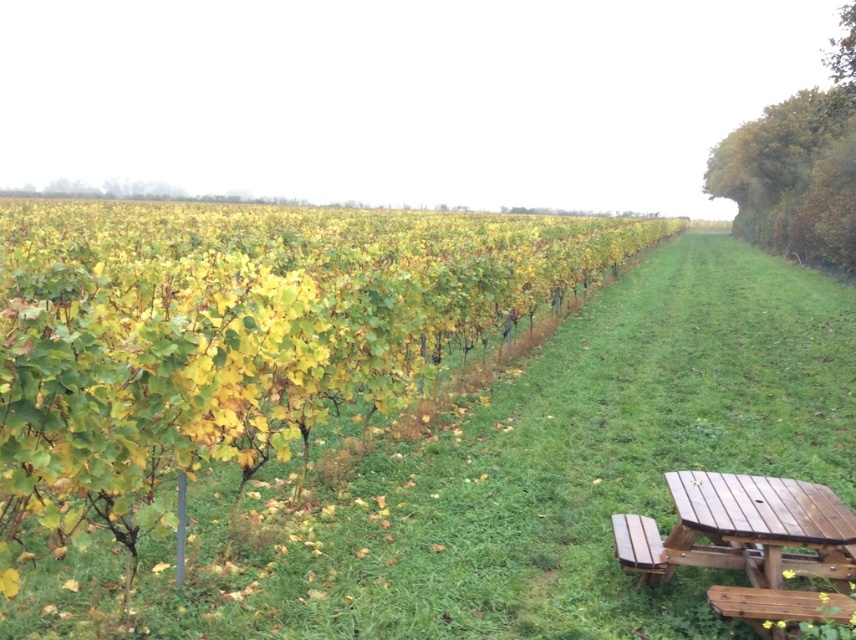
Who is shorter, green grassy at center or wooden bench at lower right?

wooden bench at lower right is shorter.

Who is more forward, (x=556, y=445) or (x=632, y=520)?

Point (x=632, y=520)

Between point (425, 492) and point (648, 570), which one is positioned in front?

Point (648, 570) is in front.

Where is `green grassy at center`? This screenshot has width=856, height=640. green grassy at center is located at coordinates (516, 480).

Who is more distant from viewer, (759, 600) or (629, 548)?

The point (629, 548) is behind.

Who is shorter, wooden picnic table at lower right or wooden bench at lower right?

Standing shorter between the two is wooden bench at lower right.

Does point (728, 502) come closer to viewer compared to point (633, 554)?

Yes, point (728, 502) is closer to viewer.

Find the location of a particular element. wooden picnic table at lower right is located at coordinates (747, 538).

What do you see at coordinates (516, 480) in the screenshot? I see `green grassy at center` at bounding box center [516, 480].

Describe the element at coordinates (516, 480) in the screenshot. I see `green grassy at center` at that location.

Locate an element on the screen. This screenshot has width=856, height=640. green grassy at center is located at coordinates (516, 480).